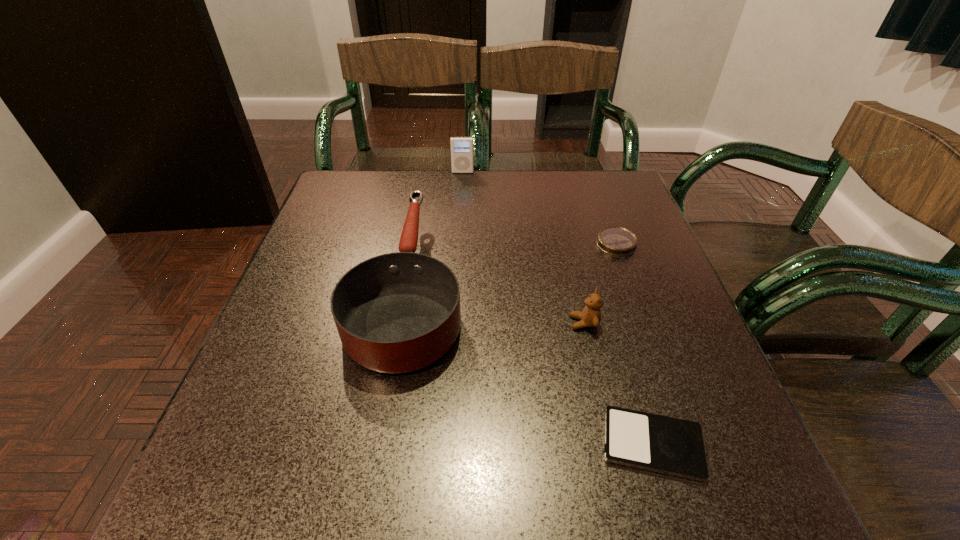
Identify the location of free space between the pan and the third shortest object. (497, 303).

Locate an element on the screen. free point between the pan and the farthest object is located at coordinates (436, 228).

At what (x,y) coordinates should I click in order to perform the action: click on empty location between the pan and the right iPod. Please return your answer as a coordinate pair (x, y). Looking at the image, I should click on (531, 364).

Locate an element on the screen. free space between the pan and the second shortest object is located at coordinates (513, 264).

The image size is (960, 540). Find the location of `blank region between the compass and the nearer iPod`. blank region between the compass and the nearer iPod is located at coordinates (635, 344).

Where is `empty space that is in between the nearer iPod and the pan`? empty space that is in between the nearer iPod and the pan is located at coordinates (531, 364).

The width and height of the screenshot is (960, 540). I want to click on free space between the third tallest object and the pan, so click(497, 303).

The width and height of the screenshot is (960, 540). Find the location of `the second closest object relative to the shortest object`. the second closest object relative to the shortest object is located at coordinates (399, 312).

Identify the location of object that is the third closest to the shorter iPod. Image resolution: width=960 pixels, height=540 pixels. (617, 241).

Find the location of a particular element. This screenshot has width=960, height=540. vacant space that satisfies the following two spatial constraints: 1. on the front-facing side of the taller iPod; 2. on the right side of the compass is located at coordinates (459, 244).